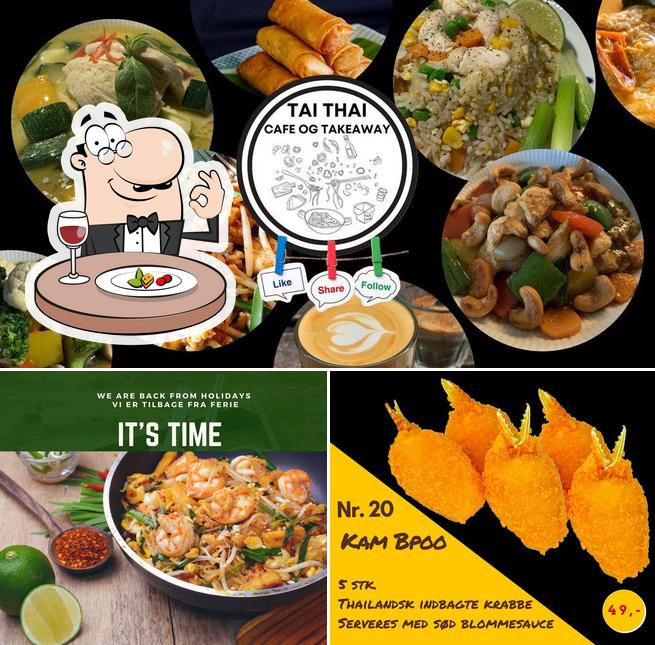
Locate an element on the screen. The height and width of the screenshot is (645, 655). table is located at coordinates (179, 306), (128, 617), (287, 362).